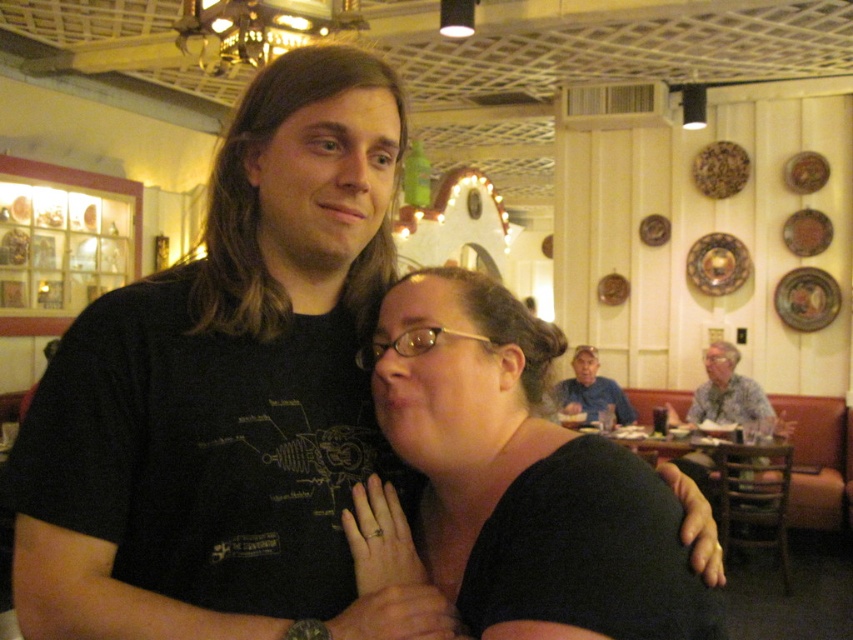
Question: Can you confirm if black matte shirt at center is positioned below blue denim shirt at upper center?

Choices:
 (A) yes
 (B) no

Answer: (B)

Question: Does black matte shirt at center appear over hawaiian print shirt at right?

Choices:
 (A) yes
 (B) no

Answer: (A)

Question: Which point is closer to the camera?

Choices:
 (A) black matte shirt at center
 (B) hawaiian print shirt at right

Answer: (A)

Question: Does black matte shirt at center have a smaller size compared to blue denim shirt at upper center?

Choices:
 (A) yes
 (B) no

Answer: (A)

Question: Among these points, which one is nearest to the camera?

Choices:
 (A) (735, 348)
 (B) (541, 323)

Answer: (B)

Question: Which of the following is the closest to the observer?

Choices:
 (A) blue denim shirt at upper center
 (B) hawaiian print shirt at right

Answer: (B)